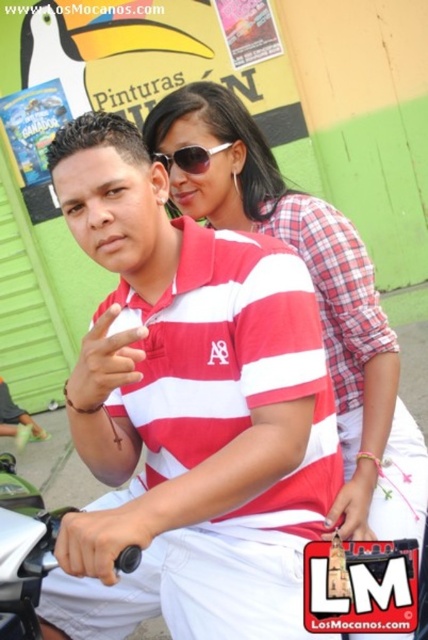
You are a photographer trying to capture a clear photo of the matte red shirt at center and the white plastic handlebar at lower left. Based on their heights, which object should you focus on first to ensure both are in frame?

The matte red shirt at center is taller than the white plastic handlebar at lower left, so you should focus on the matte red shirt at center first to ensure both are in frame.

You are a photographer taking a picture of two people on a motorcycle. You notice the white striped polo shirt at center and the sunglasses at center. Which item is closer to the camera?

The white striped polo shirt at center is positioned under the sunglasses at center, so the sunglasses at center are closer to the camera.